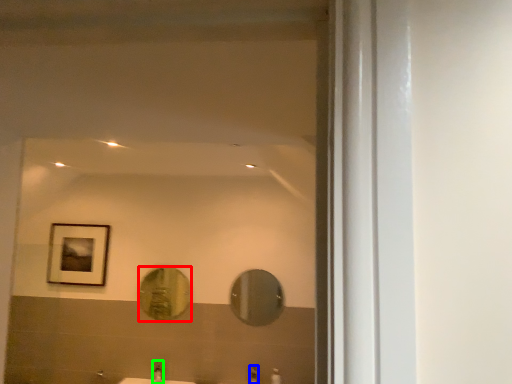
Question: Based on their relative distances, which object is nearer to mirror (highlighted by a red box)? Choose from faucet (highlighted by a blue box) and faucet (highlighted by a green box).

Choices:
 (A) faucet
 (B) faucet

Answer: (B)